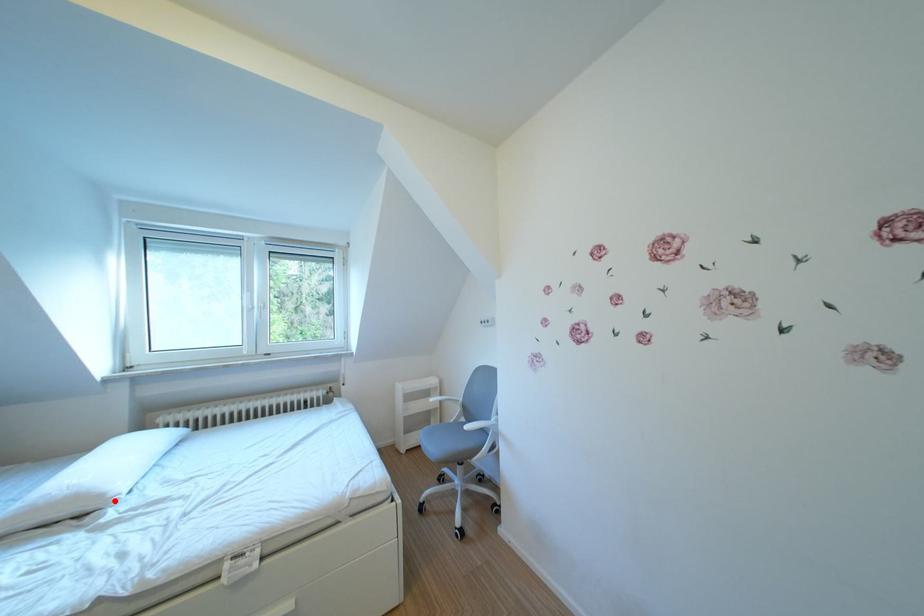
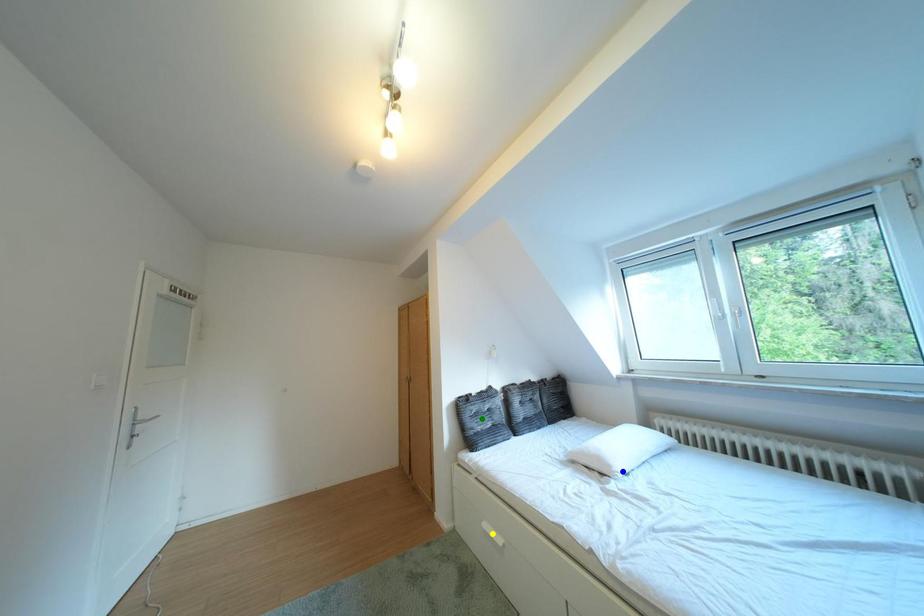
Question: I am providing you with two images of the same scene from different viewpoints. A red point is marked on the first image. You are given multiple points on the second image. Which point in image 2 is actually the same real-world point as the red point in image 1?

Choices:
 (A) blue point
 (B) yellow point
 (C) green point

Answer: (A)